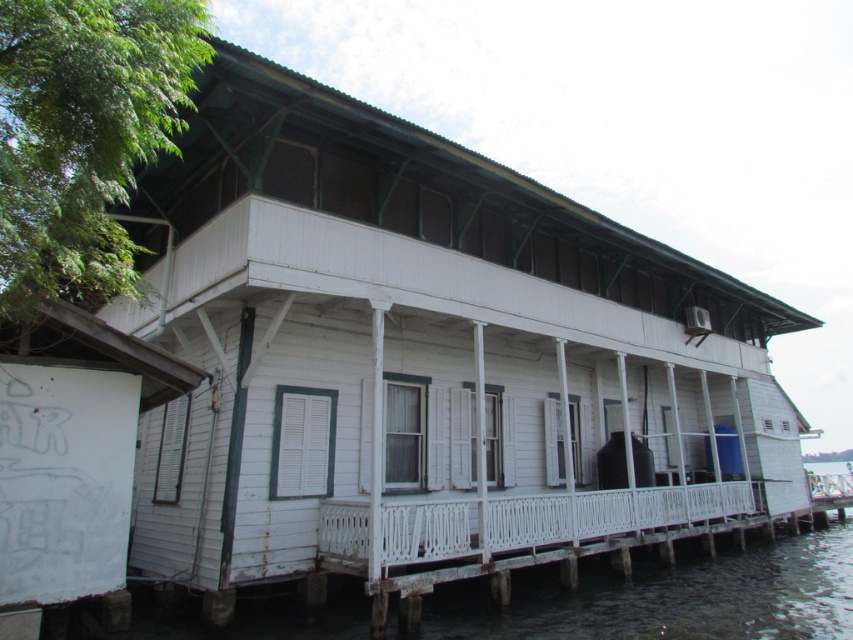
Between transparent water at lower left and white painted wood porch at center, which one is positioned lower?

Positioned lower is transparent water at lower left.

Between transparent water at lower left and white painted wood porch at center, which one has less height?

white painted wood porch at center is shorter.

Image resolution: width=853 pixels, height=640 pixels. Find the location of `transparent water at lower left`. transparent water at lower left is located at coordinates (668, 593).